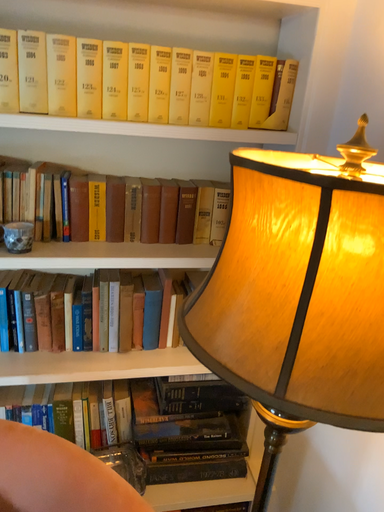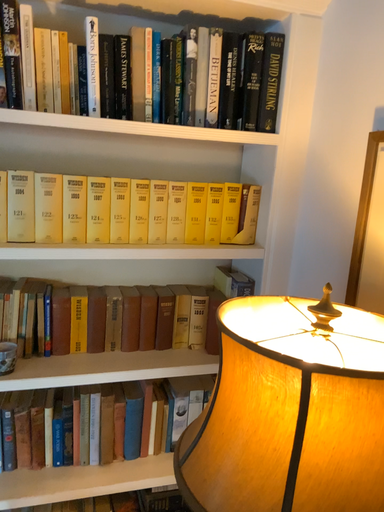
Question: Which way did the camera rotate in the video?

Choices:
 (A) rotated upward
 (B) rotated downward

Answer: (A)